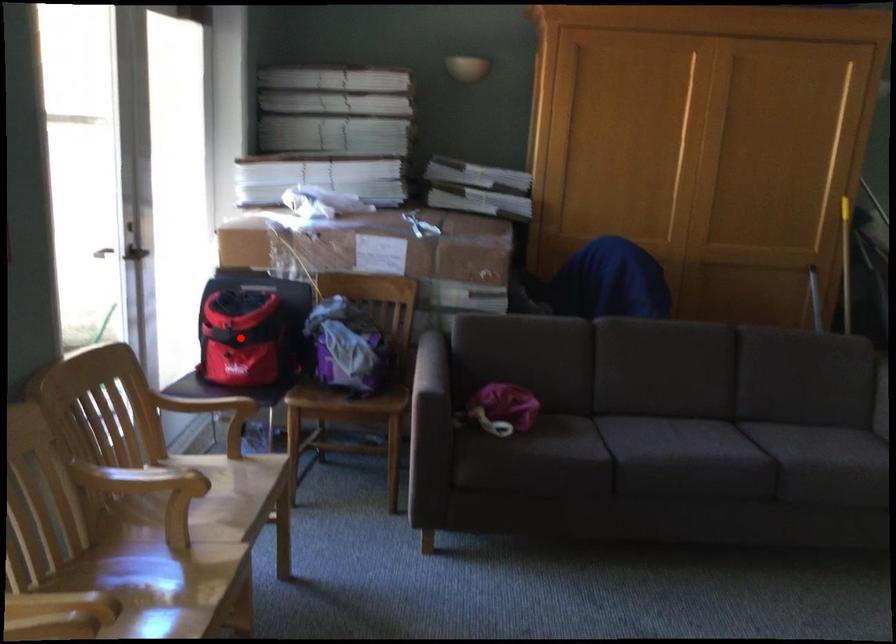
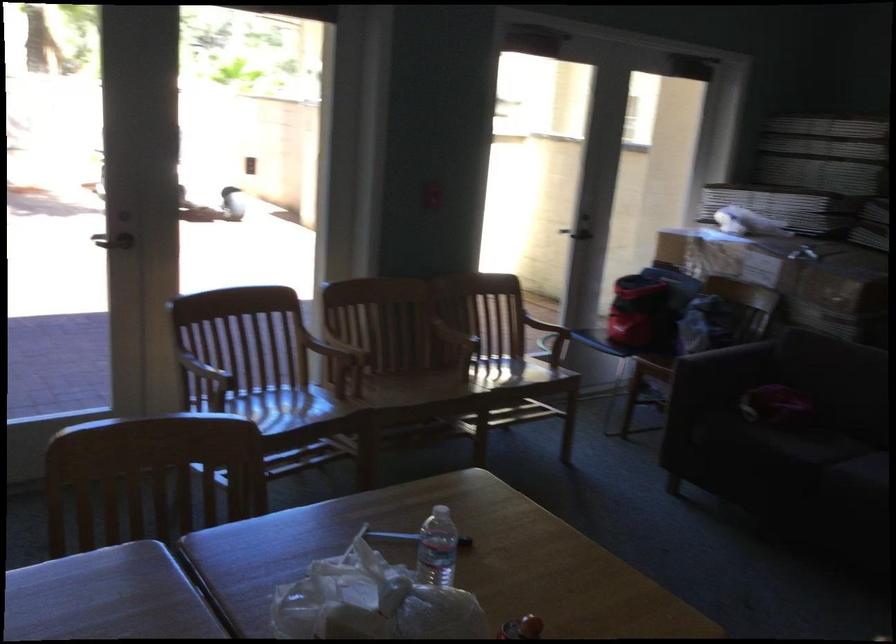
In the second image, find the point that corresponds to the highlighted location in the first image.

(645, 299)